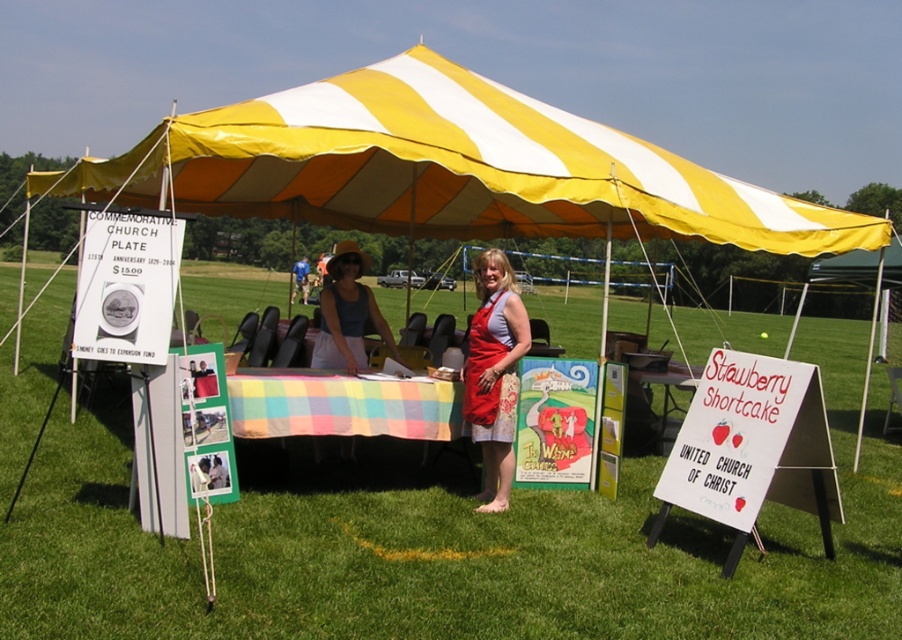
Question: Which object is positioned farthest from the multicolored checkered tablecloth at center?

Choices:
 (A) plaid fabric table at center
 (B) yellow/white striped canopy at upper center
 (C) denim jacket at center

Answer: (C)

Question: Based on their relative distances, which object is farther from the denim jacket at center?

Choices:
 (A) yellow/white striped canopy at upper center
 (B) red apron at center

Answer: (B)

Question: Is yellow/white striped canopy at upper center positioned before red apron at center?

Choices:
 (A) no
 (B) yes

Answer: (B)

Question: Can you confirm if matte gray tank top at center is positioned below plaid fabric table at center?

Choices:
 (A) no
 (B) yes

Answer: (A)

Question: Considering the real-world distances, which object is closest to the multicolored checkered tablecloth at center?

Choices:
 (A) yellow/white striped canopy at upper center
 (B) plaid fabric table at center
 (C) matte gray tank top at center

Answer: (C)

Question: Can you confirm if yellow/white striped canopy at upper center is bigger than denim jacket at center?

Choices:
 (A) yes
 (B) no

Answer: (B)